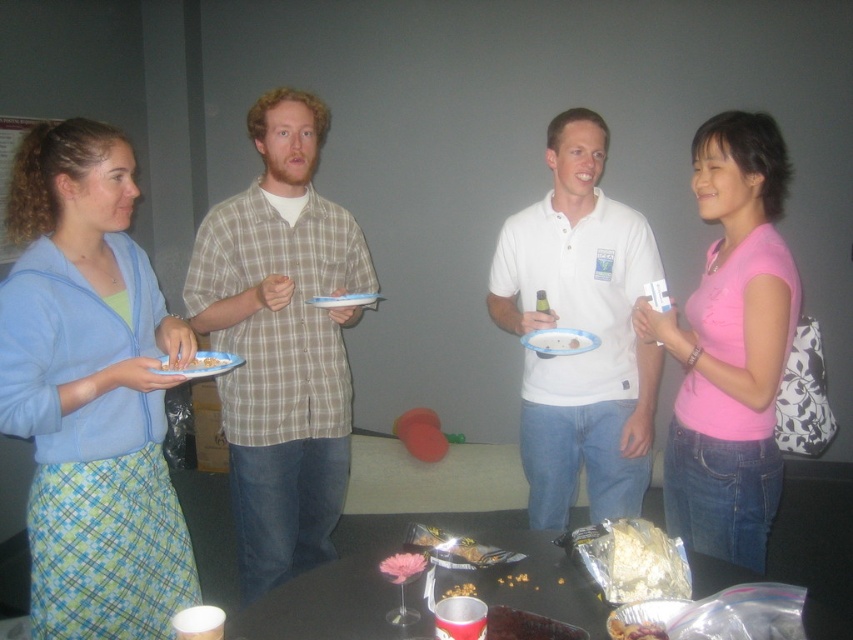
Question: Which of these objects is positioned closest to the white cotton polo shirt at center?

Choices:
 (A) plaid shirt at center
 (B) matte plastic bottle at center
 (C) matte plastic snack at center
 (D) white paper plate at center

Answer: (B)

Question: Which object is farther from the camera taking this photo?

Choices:
 (A) plaid shirt at center
 (B) white paper plate at center

Answer: (B)

Question: Does white cotton polo shirt at center lie in front of blue paper plate at center?

Choices:
 (A) no
 (B) yes

Answer: (A)

Question: Which point is farther to the camera?

Choices:
 (A) blue paper plate at center
 (B) light blue fabric sweater at left
 (C) matte plastic bottle at center

Answer: (C)

Question: Where is white cotton polo shirt at center located in relation to white paper plate at center in the image?

Choices:
 (A) below
 (B) above

Answer: (A)

Question: Is matte plastic bottle at center further to the viewer compared to shiny chocolate bar at center?

Choices:
 (A) no
 (B) yes

Answer: (B)